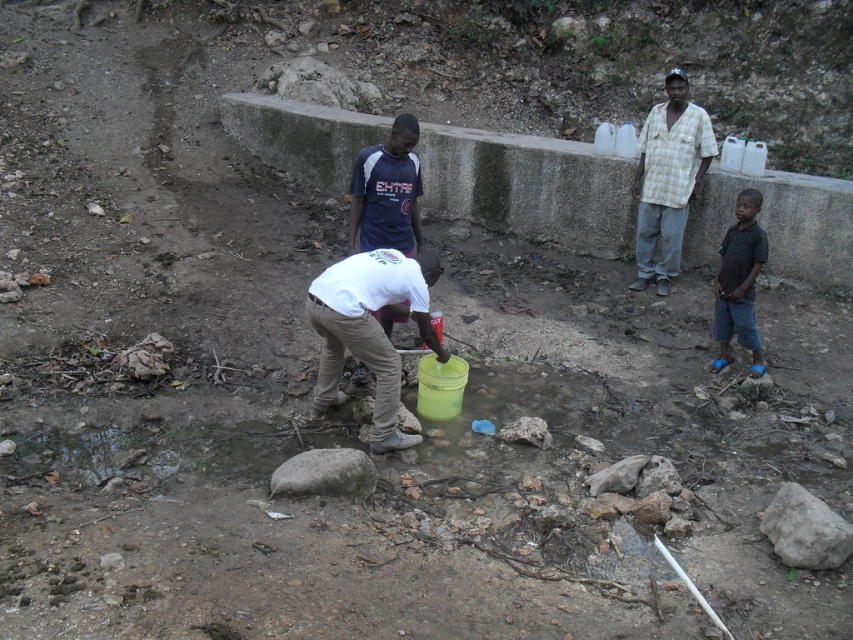
Question: Which point appears closest to the camera in this image?

Choices:
 (A) (679, 163)
 (B) (758, 241)
 (C) (323, 317)
 (D) (352, 189)

Answer: (C)

Question: Observing the image, what is the correct spatial positioning of white cotton shirt at center in reference to dark blue shirt at right?

Choices:
 (A) above
 (B) below

Answer: (A)

Question: Can you confirm if white cotton shirt at center is positioned to the right of dark blue shirt at right?

Choices:
 (A) yes
 (B) no

Answer: (B)

Question: Based on their relative distances, which object is nearer to the white cotton shirt at center?

Choices:
 (A) dark blue shirt at right
 (B) white matte shirt at center

Answer: (B)

Question: Which of the following is the farthest from the observer?

Choices:
 (A) white matte shirt at center
 (B) white cotton shirt at center
 (C) checkered shirt at upper right

Answer: (C)

Question: Is white cotton shirt at center above dark blue shirt at right?

Choices:
 (A) no
 (B) yes

Answer: (B)